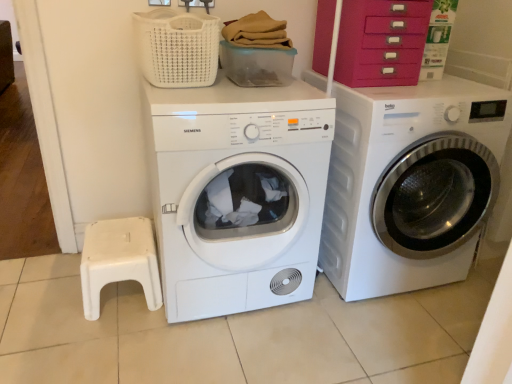
Where is `free location in front of white matte dryer at center, marked as the first washing machine in a left-to-right arrangement`? Image resolution: width=512 pixels, height=384 pixels. free location in front of white matte dryer at center, marked as the first washing machine in a left-to-right arrangement is located at coordinates (220, 352).